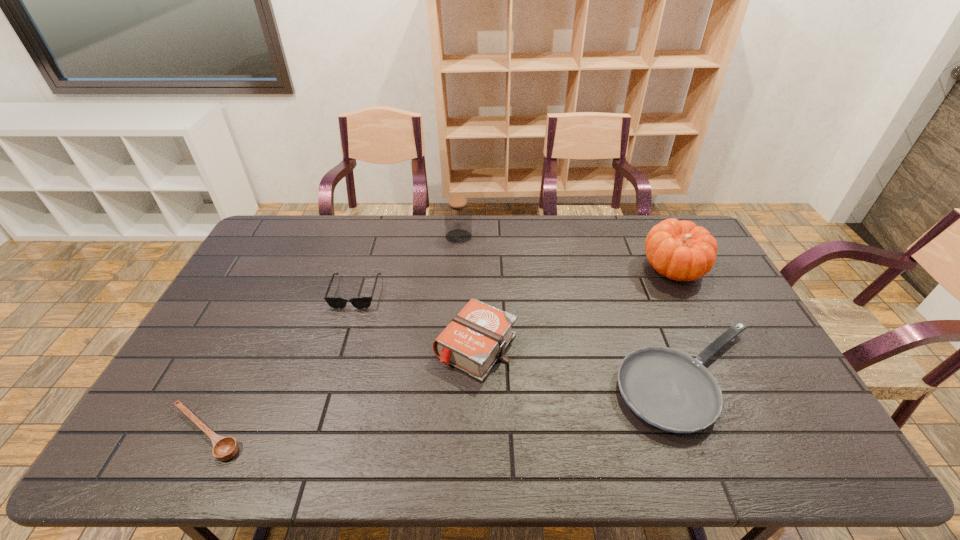
Identify the location of frying pan that is at the right edge. Image resolution: width=960 pixels, height=540 pixels. (669, 389).

Locate an element on the screen. The width and height of the screenshot is (960, 540). object present at the near left corner is located at coordinates (224, 448).

Locate an element on the screen. This screenshot has height=540, width=960. object situated at the far right corner is located at coordinates (679, 250).

Locate an element on the screen. This screenshot has width=960, height=540. object located in the near right corner section of the desktop is located at coordinates (669, 389).

Find the location of a particular element. vacant space at the far edge of the desktop is located at coordinates (597, 227).

This screenshot has width=960, height=540. Identify the location of vacant space at the left edge of the desktop. (252, 325).

This screenshot has width=960, height=540. Find the location of `free region at the right edge of the desktop`. free region at the right edge of the desktop is located at coordinates (736, 310).

At what (x,y) coordinates should I click in order to perform the action: click on vacant space at the near left corner of the desktop. Please return your answer as a coordinate pair (x, y). Looking at the image, I should click on (147, 437).

This screenshot has height=540, width=960. Find the location of `vacant space at the far right corner of the desktop`. vacant space at the far right corner of the desktop is located at coordinates (681, 217).

At what (x,y) coordinates should I click in order to perform the action: click on free spot between the third tallest object and the fourth tallest object. Please return your answer as a coordinate pair (x, y). Image resolution: width=960 pixels, height=540 pixels. Looking at the image, I should click on (416, 320).